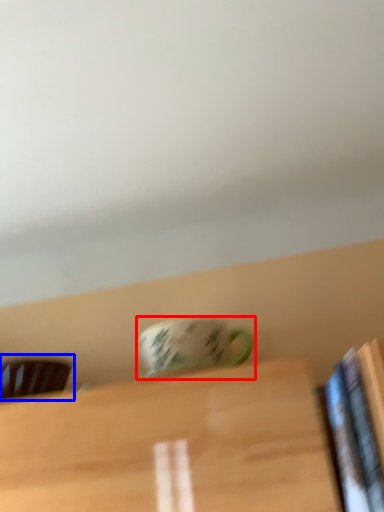
Question: Among these objects, which one is farthest to the camera, coffee cup (highlighted by a red box) or chair (highlighted by a blue box)?

Choices:
 (A) coffee cup
 (B) chair

Answer: (B)